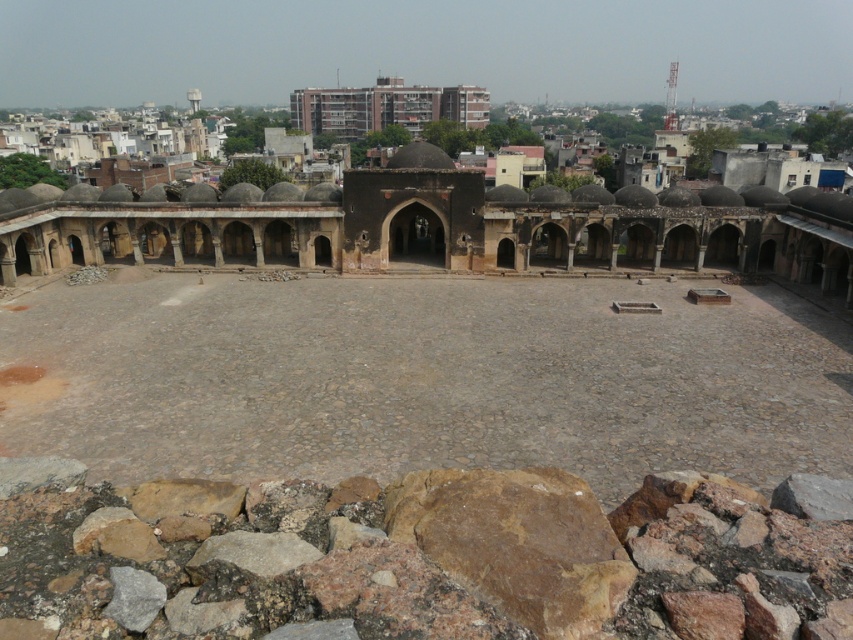
You are standing in the courtyard and want to take a photo of the brick building at upper center without the dark brown stone amphitheater at center blocking the view. Is this possible?

The dark brown stone amphitheater at center is in front of the brick building at upper center, so you cannot take a photo of the brick building at upper center without the amphitheater blocking the view unless you move to a position where the amphitheater is not between you and the building.

You are standing at the viewpoint in the courtyard and want to take a photo of the dark brown stone amphitheater at center and the brick building at upper center. Which one is positioned higher in the frame?

The brick building at upper center is positioned higher in the frame than the dark brown stone amphitheater at center.